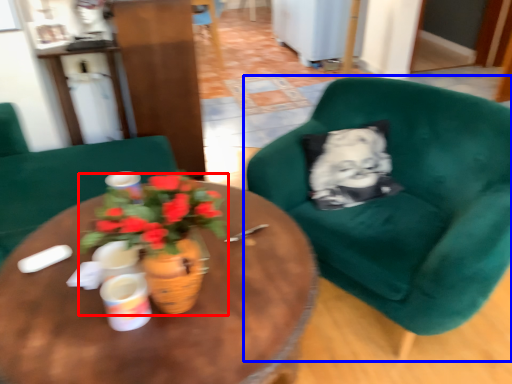
Question: Which object appears farthest to the camera in this image, houseplant (highlighted by a red box) or chair (highlighted by a blue box)?

Choices:
 (A) houseplant
 (B) chair

Answer: (B)